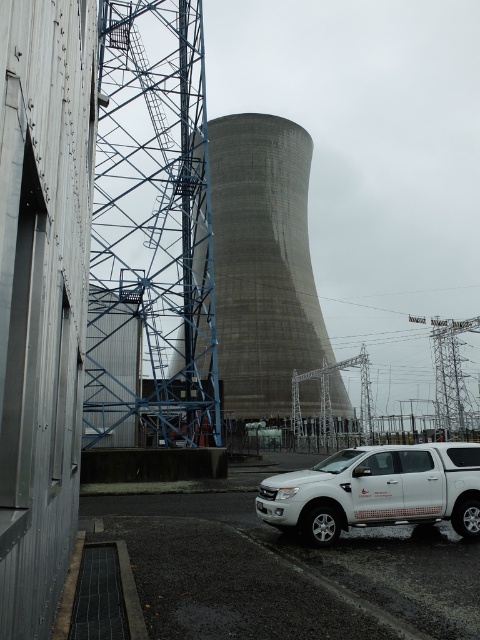
You are a maintenance worker standing at the camera position. You need to reach the blue metallic tower at left for inspection. Can you walk directly to it without crossing any obstacles?

The blue metallic tower at left is 54.57 feet away from camera. Since there are no obstacles mentioned in the scene description between your position and the tower, you can walk directly to it.

You are a delivery driver who needs to park your white matte truck at lower right as close as possible to the gray concrete cooling tower at center without blocking the entrance. Considering their sizes, can you park the truck closer than 5 meters away?

The gray concrete cooling tower at center is much taller than the white matte truck at lower right, but this height difference doesn not affect parking distance. You can park the white matte truck at lower right closer than 5 meters away from the gray concrete cooling tower at center as long as it doesn not block the entrance.

You are standing at the white pickup truck parked on the foreground. You see two points in the scene, point (233, 394) and point (342, 452). Which point is closer to you?

Point (342, 452) is closer to you because it is in front of point (233, 394).